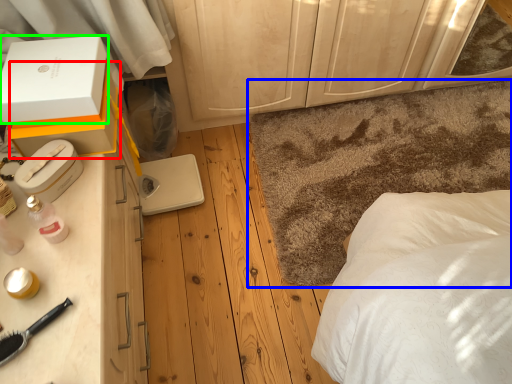
Question: Based on their relative distances, which object is farther from box (highlighted by a red box)? Choose from mat (highlighted by a blue box) and box (highlighted by a green box).

Choices:
 (A) mat
 (B) box

Answer: (A)